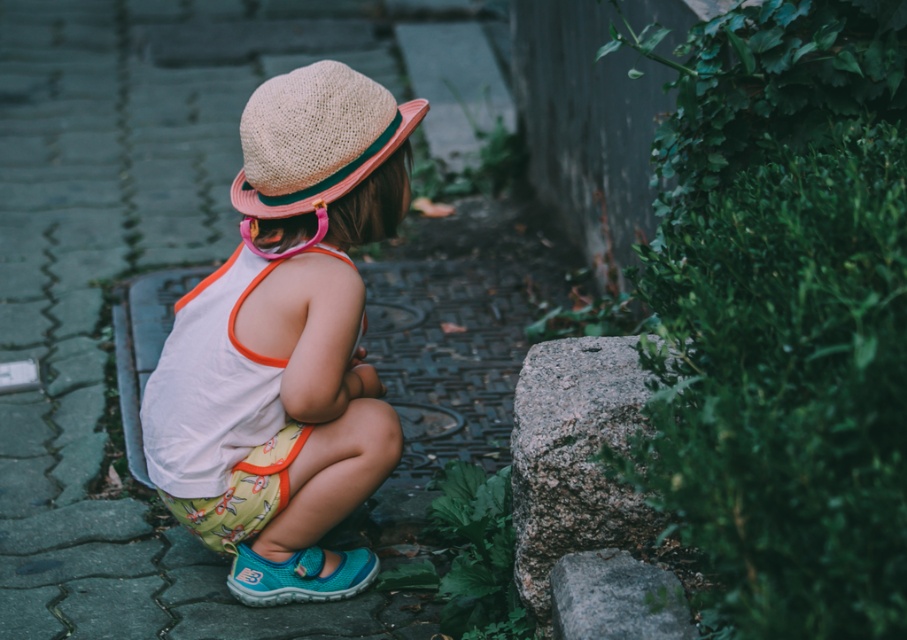
You are taking a photo of the child and want to focus on the point closest to the camera. Which point should you choose between point (152,404) and point (617,618)?

Point (152,404) is further to the camera than point (617,618), so you should choose point (152,404) to focus on the point closest to the camera.

Looking at this image, you are a photographer trying to capture the perfect shot of the matte straw hat at center. Based on the coordinates provided, where should you position your camera to ensure the hat is centered in the frame?

The matte straw hat at center is located at coordinates point (286,342), so positioning the camera to center the frame at those coordinates will ensure the hat is centered.

You are a photographer trying to capture the child and the objects in the scene. If you want to ensure both the matte straw hat at center and the granite rock at lower right are clearly visible in your photo, which object should you focus on first to avoid blurring?

The matte straw hat at center is bigger than the granite rock at lower right, so focusing on the larger object first will help ensure both are in focus as the smaller object will naturally be within the depth of field when the larger one is sharp.